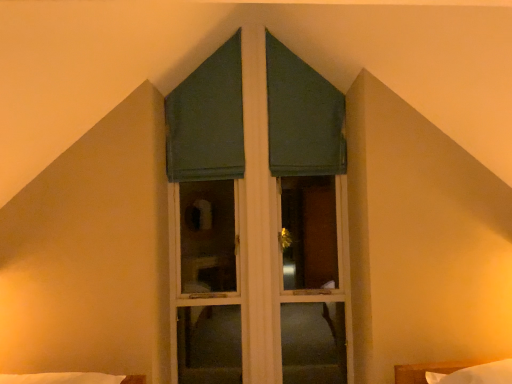
Question: Considering the relative sizes of white soft bed at lower right and green fabric curtain at upper center, marked as the second curtain in a left-to-right arrangement, in the image provided, is white soft bed at lower right thinner than green fabric curtain at upper center, marked as the second curtain in a left-to-right arrangement,?

Choices:
 (A) yes
 (B) no

Answer: (B)

Question: Would you say white soft bed at lower right is a long distance from green fabric curtain at upper center, marked as the second curtain in a left-to-right arrangement?

Choices:
 (A) no
 (B) yes

Answer: (B)

Question: Is white soft bed at lower right oriented away from green fabric curtain at upper center, marked as the second curtain in a left-to-right arrangement?

Choices:
 (A) no
 (B) yes

Answer: (A)

Question: Is white soft bed at lower right in contact with green fabric curtain at upper center, marked as the first curtain in a right-to-left arrangement?

Choices:
 (A) no
 (B) yes

Answer: (A)

Question: Does white soft bed at lower right have a greater height compared to green fabric curtain at upper center, marked as the second curtain in a left-to-right arrangement?

Choices:
 (A) yes
 (B) no

Answer: (B)

Question: Is green matte window at center taller or shorter than white soft bed at lower right?

Choices:
 (A) short
 (B) tall

Answer: (B)

Question: Is green matte window at center spatially inside white soft bed at lower right, or outside of it?

Choices:
 (A) inside
 (B) outside

Answer: (B)

Question: Relative to white soft bed at lower right, is green matte window at center in front or behind?

Choices:
 (A) front
 (B) behind

Answer: (B)

Question: From a real-world perspective, relative to white soft bed at lower right, is green matte window at center vertically above or below?

Choices:
 (A) above
 (B) below

Answer: (A)

Question: In the image, is green fabric curtain at upper center, marked as the first curtain in a right-to-left arrangement, positioned in front of or behind green fabric curtain at center, marked as the first curtain in a left-to-right arrangement?

Choices:
 (A) behind
 (B) front

Answer: (A)

Question: Looking at the image, does green fabric curtain at upper center, marked as the first curtain in a right-to-left arrangement, seem bigger or smaller compared to green fabric curtain at center, marked as the first curtain in a left-to-right arrangement?

Choices:
 (A) big
 (B) small

Answer: (A)

Question: From the image's perspective, is green fabric curtain at upper center, marked as the second curtain in a left-to-right arrangement, positioned above or below green fabric curtain at center, positioned as the 2th curtain in right-to-left order?

Choices:
 (A) above
 (B) below

Answer: (A)

Question: Is point (274, 72) closer or farther from the camera than point (214, 109)?

Choices:
 (A) farther
 (B) closer

Answer: (A)

Question: Is white soft bed at lower right wider or thinner than green fabric curtain at center, positioned as the 2th curtain in right-to-left order?

Choices:
 (A) thin
 (B) wide

Answer: (B)

Question: Is white soft bed at lower right to the left or to the right of green fabric curtain at center, marked as the first curtain in a left-to-right arrangement, in the image?

Choices:
 (A) left
 (B) right

Answer: (B)